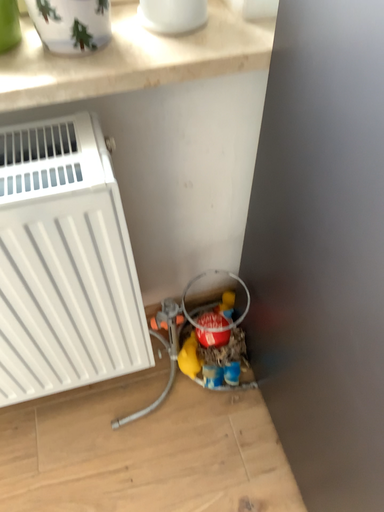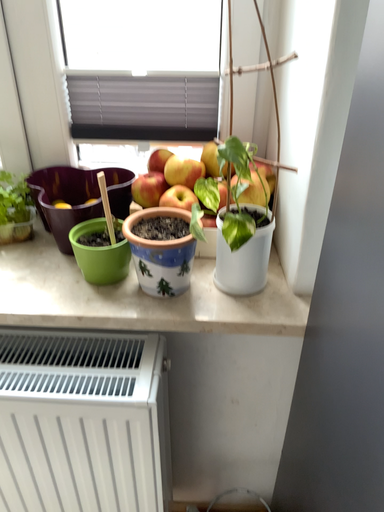
Question: Which way did the camera rotate in the video?

Choices:
 (A) rotated right
 (B) rotated left

Answer: (B)